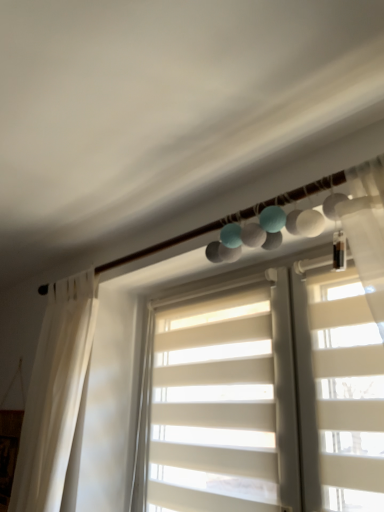
The height and width of the screenshot is (512, 384). What do you see at coordinates (214, 407) in the screenshot? I see `white matte/soft shutter at center` at bounding box center [214, 407].

At what (x,y) coordinates should I click in order to perform the action: click on white matte/soft shutter at center. Please return your answer as a coordinate pair (x, y). The width and height of the screenshot is (384, 512). Looking at the image, I should click on (214, 407).

Locate an element on the screen. This screenshot has height=512, width=384. white matte/soft shutter at center is located at coordinates (214, 407).